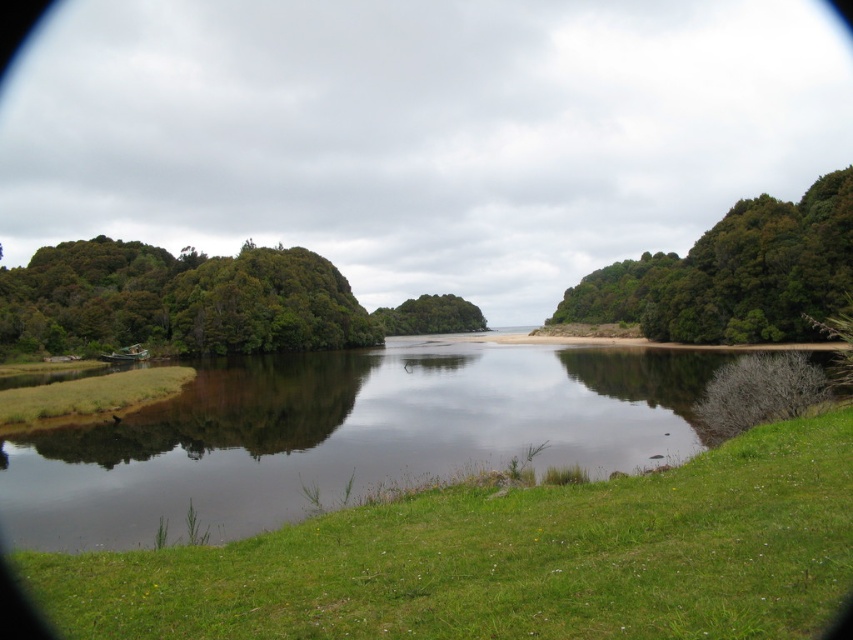
You are standing on the grassy bank near the water and want to walk to the green leafy tree at upper right. Which direction should you head towards from the green leafy trees at left?

You should head towards the right from the green leafy trees at left to reach the green leafy tree at upper right since the green leafy trees at left is to the left of green leafy tree at upper right.

You are standing at the point with coordinates 0.5, 0.5 in the image. Which direction should you move to reach the green grassy river at center?

The green grassy river at center is located at coordinates (344, 435), so you should move towards the right and slightly downward from your current position at (426, 320) to reach it.